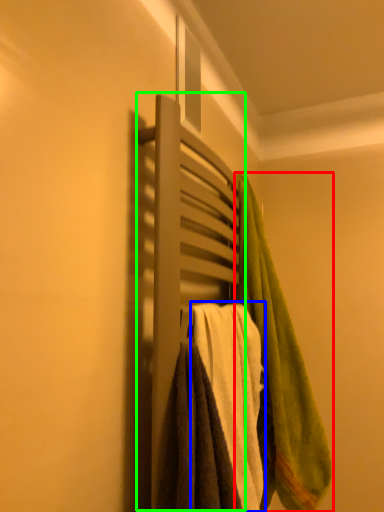
Question: Based on their relative distances, which object is farther from towel (highlighted by a red box)? Choose from towel (highlighted by a blue box) and closet (highlighted by a green box).

Choices:
 (A) towel
 (B) closet

Answer: (B)